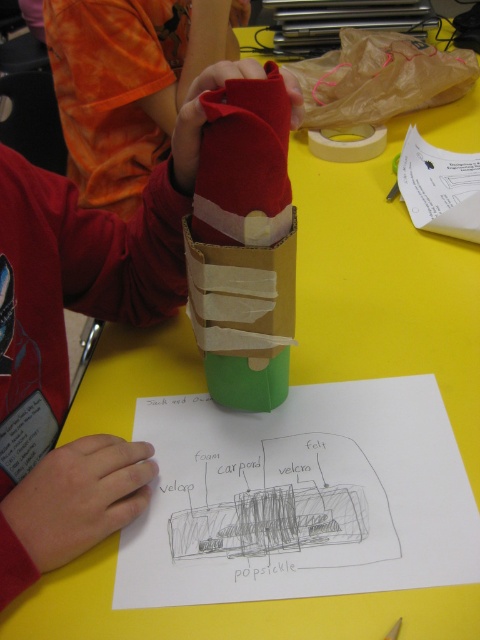
Question: Which of the following is the farthest from the observer?

Choices:
 (A) (54, 13)
 (B) (255, 532)

Answer: (A)

Question: Which object is closer to the camera taking this photo?

Choices:
 (A) brown paper bag at upper center
 (B) white paper at upper right
 (C) orange tie-dye shirt at upper left
 (D) white paper at center

Answer: (D)

Question: Is white paper at center above orange tie-dye shirt at upper left?

Choices:
 (A) yes
 (B) no

Answer: (B)

Question: Is white paper at center positioned at the back of orange tie-dye shirt at upper left?

Choices:
 (A) no
 (B) yes

Answer: (A)

Question: Based on their relative distances, which object is nearer to the white paper at upper right?

Choices:
 (A) orange tie-dye shirt at upper left
 (B) white paper at center

Answer: (B)

Question: Does orange tie-dye shirt at upper left have a greater width compared to white paper at upper right?

Choices:
 (A) yes
 (B) no

Answer: (A)